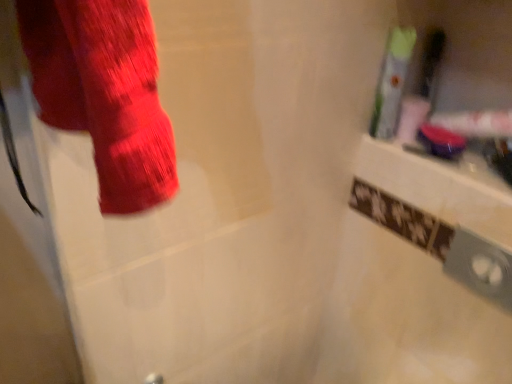
Locate an element on the screen. The image size is (512, 384). green plastic toothbrush at upper right, the 1th toiletry in the left-to-right sequence is located at coordinates (392, 82).

What do you see at coordinates (392, 82) in the screenshot? The image size is (512, 384). I see `green plastic toothbrush at upper right, acting as the 2th toiletry starting from the right` at bounding box center [392, 82].

Describe the element at coordinates (421, 88) in the screenshot. This screenshot has height=384, width=512. I see `translucent plastic toothbrush at upper right, which is counted as the 2th toiletry, starting from the left` at that location.

Image resolution: width=512 pixels, height=384 pixels. Find the location of `translucent plastic toothbrush at upper right, which is counted as the 2th toiletry, starting from the left`. translucent plastic toothbrush at upper right, which is counted as the 2th toiletry, starting from the left is located at coordinates (421, 88).

Measure the distance between translucent plastic toothbrush at upper right, which is counted as the 2th toiletry, starting from the left, and camera.

38.54 inches.

I want to click on green plastic toothbrush at upper right, the 1th toiletry in the left-to-right sequence, so click(x=392, y=82).

Is translucent plastic toothbrush at upper right, the 1th toiletry when ordered from right to left, to the left of green plastic toothbrush at upper right, acting as the 2th toiletry starting from the right, from the viewer's perspective?

Incorrect, translucent plastic toothbrush at upper right, the 1th toiletry when ordered from right to left, is not on the left side of green plastic toothbrush at upper right, acting as the 2th toiletry starting from the right.

Does translucent plastic toothbrush at upper right, the 1th toiletry when ordered from right to left, come behind green plastic toothbrush at upper right, the 1th toiletry in the left-to-right sequence?

Yes, translucent plastic toothbrush at upper right, the 1th toiletry when ordered from right to left, is further from the camera.

Which is further, (437, 29) or (390, 77)?

The point (437, 29) is more distant.

From the image's perspective, is translucent plastic toothbrush at upper right, which is counted as the 2th toiletry, starting from the left, below green plastic toothbrush at upper right, acting as the 2th toiletry starting from the right?

No, from the image's perspective, translucent plastic toothbrush at upper right, which is counted as the 2th toiletry, starting from the left, is not below green plastic toothbrush at upper right, acting as the 2th toiletry starting from the right.

From a real-world perspective, is translucent plastic toothbrush at upper right, the 1th toiletry when ordered from right to left, under green plastic toothbrush at upper right, the 1th toiletry in the left-to-right sequence?

Yes, from a real-world perspective, translucent plastic toothbrush at upper right, the 1th toiletry when ordered from right to left, is below green plastic toothbrush at upper right, the 1th toiletry in the left-to-right sequence.

Between translucent plastic toothbrush at upper right, the 1th toiletry when ordered from right to left, and green plastic toothbrush at upper right, the 1th toiletry in the left-to-right sequence, which one has larger width?

With larger width is green plastic toothbrush at upper right, the 1th toiletry in the left-to-right sequence.

Considering the sizes of translucent plastic toothbrush at upper right, which is counted as the 2th toiletry, starting from the left, and green plastic toothbrush at upper right, the 1th toiletry in the left-to-right sequence, in the image, is translucent plastic toothbrush at upper right, which is counted as the 2th toiletry, starting from the left, taller or shorter than green plastic toothbrush at upper right, the 1th toiletry in the left-to-right sequence,?

Considering their sizes, translucent plastic toothbrush at upper right, which is counted as the 2th toiletry, starting from the left, has less height than green plastic toothbrush at upper right, the 1th toiletry in the left-to-right sequence.

In terms of size, does translucent plastic toothbrush at upper right, which is counted as the 2th toiletry, starting from the left, appear bigger or smaller than green plastic toothbrush at upper right, acting as the 2th toiletry starting from the right?

Considering their sizes, translucent plastic toothbrush at upper right, which is counted as the 2th toiletry, starting from the left, takes up less space than green plastic toothbrush at upper right, acting as the 2th toiletry starting from the right.

Is green plastic toothbrush at upper right, acting as the 2th toiletry starting from the right, located within translucent plastic toothbrush at upper right, which is counted as the 2th toiletry, starting from the left?

No, translucent plastic toothbrush at upper right, which is counted as the 2th toiletry, starting from the left, does not contain green plastic toothbrush at upper right, acting as the 2th toiletry starting from the right.

Is translucent plastic toothbrush at upper right, which is counted as the 2th toiletry, starting from the left, next to green plastic toothbrush at upper right, the 1th toiletry in the left-to-right sequence, and touching it?

Absolutely, translucent plastic toothbrush at upper right, which is counted as the 2th toiletry, starting from the left, is next to and touching green plastic toothbrush at upper right, the 1th toiletry in the left-to-right sequence.

Is translucent plastic toothbrush at upper right, which is counted as the 2th toiletry, starting from the left, aimed at green plastic toothbrush at upper right, acting as the 2th toiletry starting from the right?

Yes.

How many degrees apart are the facing directions of translucent plastic toothbrush at upper right, which is counted as the 2th toiletry, starting from the left, and green plastic toothbrush at upper right, acting as the 2th toiletry starting from the right?

They differ by 0.00687 degrees in their facing directions.

Image resolution: width=512 pixels, height=384 pixels. Find the location of `toiletry in front of the translucent plastic toothbrush at upper right, which is counted as the 2th toiletry, starting from the left`. toiletry in front of the translucent plastic toothbrush at upper right, which is counted as the 2th toiletry, starting from the left is located at coordinates (392, 82).

Does green plastic toothbrush at upper right, acting as the 2th toiletry starting from the right, appear on the right side of translucent plastic toothbrush at upper right, the 1th toiletry when ordered from right to left?

No.

Relative to translucent plastic toothbrush at upper right, the 1th toiletry when ordered from right to left, is green plastic toothbrush at upper right, the 1th toiletry in the left-to-right sequence, in front or behind?

Clearly, green plastic toothbrush at upper right, the 1th toiletry in the left-to-right sequence, is in front of translucent plastic toothbrush at upper right, the 1th toiletry when ordered from right to left.

Considering the points (397, 44) and (398, 134), which point is behind, point (397, 44) or point (398, 134)?

The point (398, 134) is behind.

From the image's perspective, would you say green plastic toothbrush at upper right, the 1th toiletry in the left-to-right sequence, is shown under translucent plastic toothbrush at upper right, the 1th toiletry when ordered from right to left?

Yes, from the image's perspective, green plastic toothbrush at upper right, the 1th toiletry in the left-to-right sequence, is below translucent plastic toothbrush at upper right, the 1th toiletry when ordered from right to left.

From a real-world perspective, which is physically below, green plastic toothbrush at upper right, the 1th toiletry in the left-to-right sequence, or translucent plastic toothbrush at upper right, which is counted as the 2th toiletry, starting from the left?

translucent plastic toothbrush at upper right, which is counted as the 2th toiletry, starting from the left.

Is green plastic toothbrush at upper right, acting as the 2th toiletry starting from the right, wider or thinner than translucent plastic toothbrush at upper right, which is counted as the 2th toiletry, starting from the left?

Considering their sizes, green plastic toothbrush at upper right, acting as the 2th toiletry starting from the right, looks broader than translucent plastic toothbrush at upper right, which is counted as the 2th toiletry, starting from the left.

Considering the sizes of objects green plastic toothbrush at upper right, the 1th toiletry in the left-to-right sequence, and translucent plastic toothbrush at upper right, the 1th toiletry when ordered from right to left, in the image provided, who is taller, green plastic toothbrush at upper right, the 1th toiletry in the left-to-right sequence, or translucent plastic toothbrush at upper right, the 1th toiletry when ordered from right to left,?

Standing taller between the two is green plastic toothbrush at upper right, the 1th toiletry in the left-to-right sequence.

Is green plastic toothbrush at upper right, the 1th toiletry in the left-to-right sequence, smaller than translucent plastic toothbrush at upper right, which is counted as the 2th toiletry, starting from the left?

No, green plastic toothbrush at upper right, the 1th toiletry in the left-to-right sequence, is not smaller than translucent plastic toothbrush at upper right, which is counted as the 2th toiletry, starting from the left.

Is green plastic toothbrush at upper right, the 1th toiletry in the left-to-right sequence, located outside translucent plastic toothbrush at upper right, the 1th toiletry when ordered from right to left?

Absolutely, green plastic toothbrush at upper right, the 1th toiletry in the left-to-right sequence, is external to translucent plastic toothbrush at upper right, the 1th toiletry when ordered from right to left.

Are green plastic toothbrush at upper right, acting as the 2th toiletry starting from the right, and translucent plastic toothbrush at upper right, the 1th toiletry when ordered from right to left, located far from each other?

green plastic toothbrush at upper right, acting as the 2th toiletry starting from the right, is actually quite close to translucent plastic toothbrush at upper right, the 1th toiletry when ordered from right to left.

Is green plastic toothbrush at upper right, the 1th toiletry in the left-to-right sequence, oriented towards translucent plastic toothbrush at upper right, which is counted as the 2th toiletry, starting from the left?

Yes, green plastic toothbrush at upper right, the 1th toiletry in the left-to-right sequence, is facing translucent plastic toothbrush at upper right, which is counted as the 2th toiletry, starting from the left.

Identify the location of toiletry located below the translucent plastic toothbrush at upper right, which is counted as the 2th toiletry, starting from the left (from the image's perspective). The image size is (512, 384). (392, 82).

Locate an element on the screen. The image size is (512, 384). toiletry in front of the translucent plastic toothbrush at upper right, the 1th toiletry when ordered from right to left is located at coordinates (392, 82).

At what (x,y) coordinates should I click in order to perform the action: click on toiletry behind the green plastic toothbrush at upper right, the 1th toiletry in the left-to-right sequence. Please return your answer as a coordinate pair (x, y). Looking at the image, I should click on (421, 88).